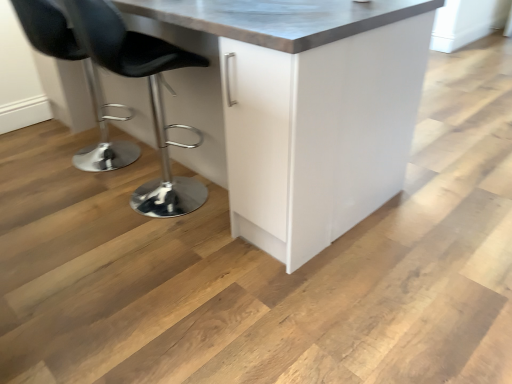
Find the location of a particular element. Image resolution: width=512 pixels, height=384 pixels. vacant area that lies between black leather stool at left, the first chair in the left-to-right sequence, and black leather stool at left, arranged as the 2th chair when viewed from the left is located at coordinates (118, 176).